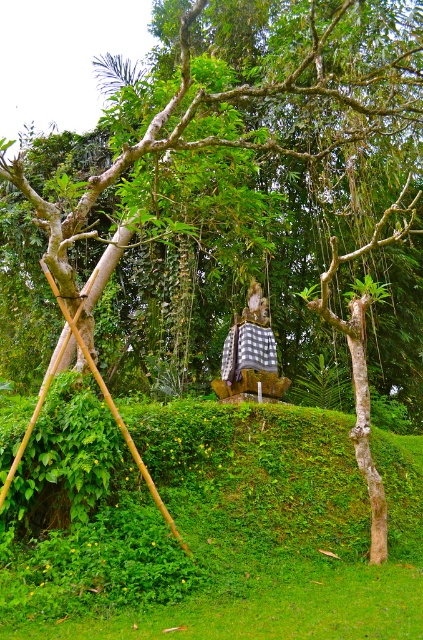
You are standing in front of the rustic wooden swing in the tropical garden. You notice two points marked on the swing. One is at coordinate point (x=58, y=605) and the other at point (x=230, y=353). Which of these points is closer to your current position?

Point (x=58, y=605) is closer to the camera than point (x=230, y=353), so the point at coordinate point (x=58, y=605) is closer to your current position.

You are standing in the tropical garden and want to sit on the green grassy at center. However, there is a checkered fabric statue at center in the way. Which direction should you move to avoid it?

The green grassy at center is below the checkered fabric statue at center, so you should move downward to reach the green grassy at center without hitting the checkered fabric statue at center.

You are standing at the origin point of the scene. Which direction should you walk to reach the green grassy at center?

The green grassy at center is located at coordinates point (214, 529), so you should walk towards the northeast direction to reach it.